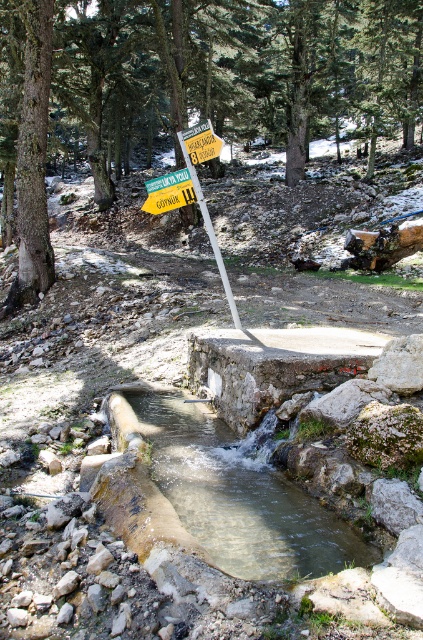
Question: Among these points, which one is farthest from the camera?

Choices:
 (A) (209, 237)
 (B) (379, 93)
 (C) (379, 552)

Answer: (B)

Question: Does brown rough tree at upper center have a smaller size compared to yellow plastic signpost at center?

Choices:
 (A) yes
 (B) no

Answer: (B)

Question: Which point is closer to the camera taking this photo?

Choices:
 (A) (272, 515)
 (B) (169, 195)

Answer: (A)

Question: Which object is positioned closest to the brown rough tree at upper center?

Choices:
 (A) clear water at stream center
 (B) yellow plastic signpost at center

Answer: (B)

Question: Can you confirm if brown rough tree at upper center is thinner than yellow plastic signpost at center?

Choices:
 (A) yes
 (B) no

Answer: (B)

Question: Does brown rough tree at upper center appear on the left side of yellow plastic signpost at center?

Choices:
 (A) yes
 (B) no

Answer: (A)